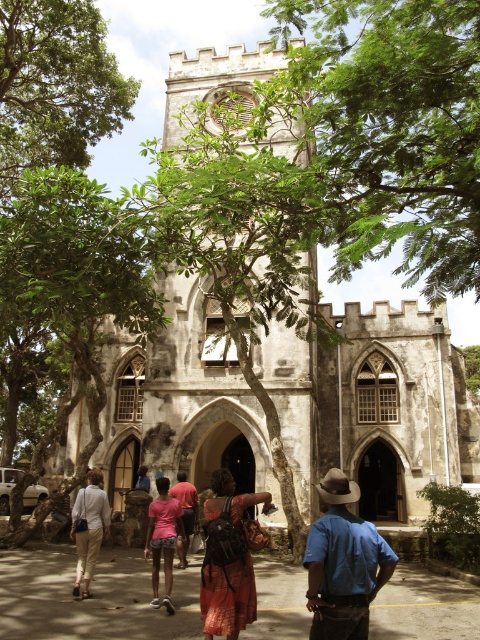
Question: Which point appears closest to the camera in this image?

Choices:
 (A) (156, 536)
 (B) (372, 532)

Answer: (B)

Question: Is white stone tower at center to the left of pink fabric dress at center from the viewer's perspective?

Choices:
 (A) yes
 (B) no

Answer: (B)

Question: Is white stone tower at center positioned in front of light beige pants at lower left?

Choices:
 (A) yes
 (B) no

Answer: (B)

Question: Which of the following is the closest to the observer?

Choices:
 (A) pink fabric dress at center
 (B) white stone tower at center
 (C) green leafy tree at upper left

Answer: (B)

Question: Estimate the real-world distances between objects in this image. Which object is farther from the printed cotton dress at center?

Choices:
 (A) pink fabric dress at center
 (B) green leafy tree at upper left
 (C) light beige pants at lower left
 (D) white stone tower at center

Answer: (B)

Question: Is green leafy tree at center smaller than green leafy tree at upper left?

Choices:
 (A) no
 (B) yes

Answer: (A)